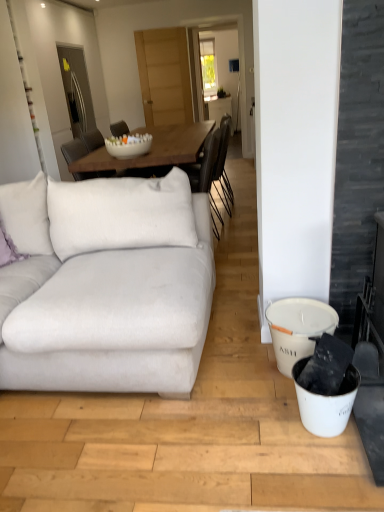
Question: Should I look upward or downward to see purple velvet pillow at left?

Choices:
 (A) down
 (B) up

Answer: (B)

Question: Considering the relative sizes of white fabric couch at left and white glossy bowl at center in the image provided, is white fabric couch at left taller than white glossy bowl at center?

Choices:
 (A) yes
 (B) no

Answer: (A)

Question: Considering the relative positions of white fabric couch at left and white glossy bowl at center in the image provided, is white fabric couch at left behind white glossy bowl at center?

Choices:
 (A) yes
 (B) no

Answer: (B)

Question: From the image's perspective, is white fabric couch at left below white glossy bowl at center?

Choices:
 (A) no
 (B) yes

Answer: (B)

Question: Is the surface of white fabric couch at left in direct contact with white glossy bowl at center?

Choices:
 (A) yes
 (B) no

Answer: (B)

Question: From the image's perspective, would you say white fabric couch at left is positioned over white glossy bowl at center?

Choices:
 (A) yes
 (B) no

Answer: (B)

Question: From a real-world perspective, is white fabric couch at left below white glossy bowl at center?

Choices:
 (A) no
 (B) yes

Answer: (B)

Question: Considering the relative positions of purple velvet pillow at left and white glossy bowl at center in the image provided, is purple velvet pillow at left behind white glossy bowl at center?

Choices:
 (A) yes
 (B) no

Answer: (B)

Question: Considering the relative sizes of purple velvet pillow at left and white glossy bowl at center in the image provided, is purple velvet pillow at left bigger than white glossy bowl at center?

Choices:
 (A) yes
 (B) no

Answer: (B)

Question: Does purple velvet pillow at left appear on the left side of white glossy bowl at center?

Choices:
 (A) no
 (B) yes

Answer: (B)

Question: Considering the relative sizes of purple velvet pillow at left and white glossy bowl at center in the image provided, is purple velvet pillow at left taller than white glossy bowl at center?

Choices:
 (A) no
 (B) yes

Answer: (B)

Question: Could you tell me if purple velvet pillow at left is turned towards white glossy bowl at center?

Choices:
 (A) yes
 (B) no

Answer: (B)

Question: From the image's perspective, is purple velvet pillow at left over white glossy bowl at center?

Choices:
 (A) yes
 (B) no

Answer: (B)

Question: Can you confirm if white glossy bowl at center is positioned to the right of white matte bucket at lower right?

Choices:
 (A) no
 (B) yes

Answer: (A)